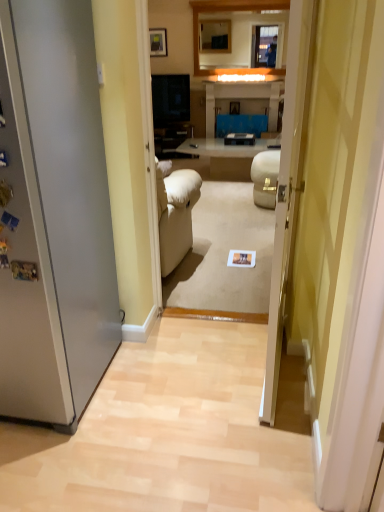
Describe the element at coordinates (332, 237) in the screenshot. The height and width of the screenshot is (512, 384). I see `transparent glass door at center` at that location.

Identify the location of transparent glass door at center. The width and height of the screenshot is (384, 512). (332, 237).

At what (x,y) coordinates should I click in order to perform the action: click on matte black picture frame at upper center. Please return your answer as a coordinate pair (x, y). Looking at the image, I should click on (158, 42).

This screenshot has width=384, height=512. What do you see at coordinates (158, 42) in the screenshot?
I see `matte black picture frame at upper center` at bounding box center [158, 42].

Locate an element on the screen. The image size is (384, 512). transparent glass door at center is located at coordinates (332, 237).

In the image, is transparent glass door at center on the left side or the right side of matte black picture frame at upper center?

Based on their positions, transparent glass door at center is located to the right of matte black picture frame at upper center.

Does transparent glass door at center lie in front of matte black picture frame at upper center?

That is True.

Is point (317, 94) closer or farther from the camera than point (157, 28)?

Point (317, 94) appears to be closer to the viewer than point (157, 28).

From the image's perspective, would you say transparent glass door at center is positioned over matte black picture frame at upper center?

No, from the image's perspective, transparent glass door at center is not over matte black picture frame at upper center.

From a real-world perspective, which is physically above, transparent glass door at center or matte black picture frame at upper center?

matte black picture frame at upper center.

Can you confirm if transparent glass door at center is thinner than matte black picture frame at upper center?

In fact, transparent glass door at center might be wider than matte black picture frame at upper center.

From the picture: Which of these two, transparent glass door at center or matte black picture frame at upper center, stands taller?

transparent glass door at center.

Is transparent glass door at center smaller than matte black picture frame at upper center?

Incorrect, transparent glass door at center is not smaller in size than matte black picture frame at upper center.

Is matte black picture frame at upper center surrounded by transparent glass door at center?

No, matte black picture frame at upper center is located outside of transparent glass door at center.

Is transparent glass door at center beside matte black picture frame at upper center?

No, transparent glass door at center is not in contact with matte black picture frame at upper center.

Is transparent glass door at center oriented towards matte black picture frame at upper center?

No, transparent glass door at center is not facing towards matte black picture frame at upper center.

Measure the distance from transparent glass door at center to matte black picture frame at upper center.

transparent glass door at center is 5.64 meters from matte black picture frame at upper center.

Where is `picture frame above the transparent glass door at center (from a real-world perspective)`? This screenshot has width=384, height=512. picture frame above the transparent glass door at center (from a real-world perspective) is located at coordinates (158, 42).

Between matte black picture frame at upper center and transparent glass door at center, which one appears on the right side from the viewer's perspective?

Positioned to the right is transparent glass door at center.

Consider the image. Is the depth of matte black picture frame at upper center greater than that of transparent glass door at center?

Yes, matte black picture frame at upper center is further from the camera.

Considering the positions of points (153, 56) and (352, 0), is point (153, 56) closer to camera compared to point (352, 0)?

No, it is behind (352, 0).

From the image's perspective, between matte black picture frame at upper center and transparent glass door at center, which one is located above?

matte black picture frame at upper center, from the image's perspective.

From a real-world perspective, is matte black picture frame at upper center positioned over transparent glass door at center based on gravity?

Correct, in the physical world, matte black picture frame at upper center is higher than transparent glass door at center.

Considering the relative sizes of matte black picture frame at upper center and transparent glass door at center in the image provided, is matte black picture frame at upper center thinner than transparent glass door at center?

Yes.

Considering the sizes of matte black picture frame at upper center and transparent glass door at center in the image, is matte black picture frame at upper center taller or shorter than transparent glass door at center?

Clearly, matte black picture frame at upper center is shorter compared to transparent glass door at center.

In the scene shown: Considering the relative sizes of matte black picture frame at upper center and transparent glass door at center in the image provided, is matte black picture frame at upper center smaller than transparent glass door at center?

Yes, matte black picture frame at upper center is smaller than transparent glass door at center.

Can we say matte black picture frame at upper center lies outside transparent glass door at center?

matte black picture frame at upper center is positioned outside transparent glass door at center.

Would you say matte black picture frame at upper center is a long distance from transparent glass door at center?

Absolutely, matte black picture frame at upper center is distant from transparent glass door at center.

Is matte black picture frame at upper center positioned with its back to transparent glass door at center?

No, transparent glass door at center is not at the back of matte black picture frame at upper center.

How many degrees apart are the facing directions of matte black picture frame at upper center and transparent glass door at center?

The facing directions of matte black picture frame at upper center and transparent glass door at center are 3.79 degrees apart.

How distant is matte black picture frame at upper center from transparent glass door at center?

5.64 meters.

Locate an element on the screen. The image size is (384, 512). picture frame behind the transparent glass door at center is located at coordinates (158, 42).

The image size is (384, 512). Identify the location of picture frame located on the left of transparent glass door at center. (158, 42).

Identify the location of picture frame located behind the transparent glass door at center. This screenshot has height=512, width=384. (158, 42).